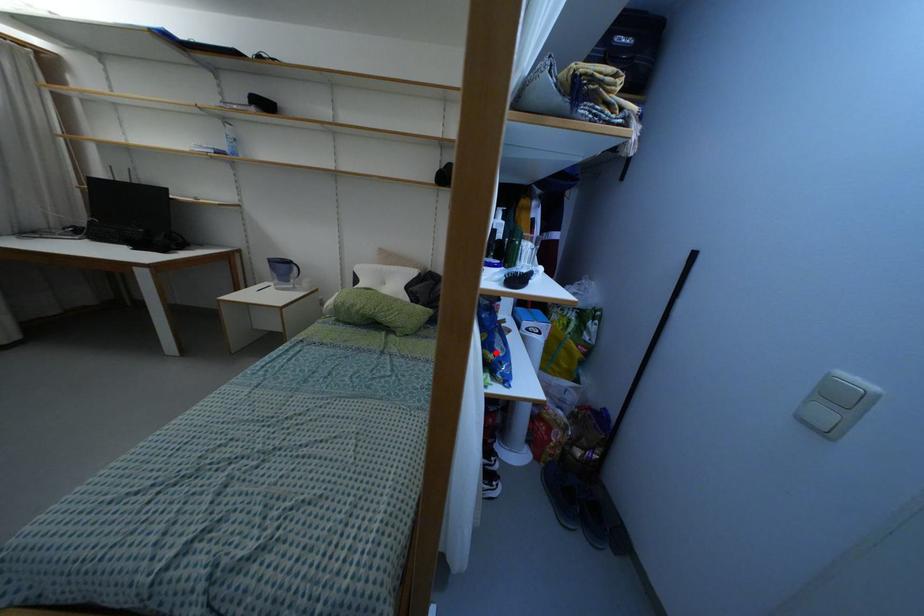
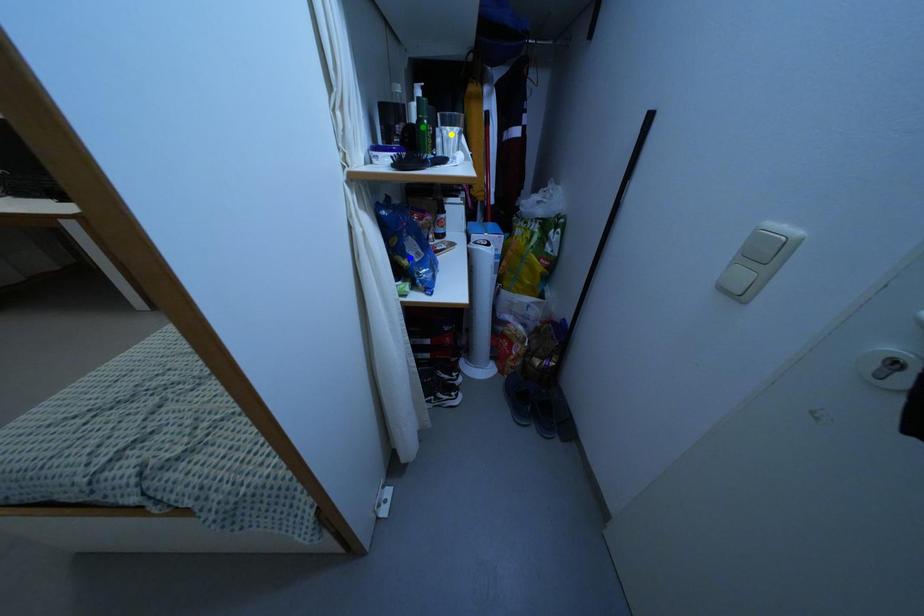
Question: I am providing you with two images of the same scene from different viewpoints. A red point is marked on the first image. You are given multiple points on the second image. Which mark in image 2 goes with the point in image 1?

Choices:
 (A) yellow point
 (B) blue point
 (C) green point

Answer: (B)